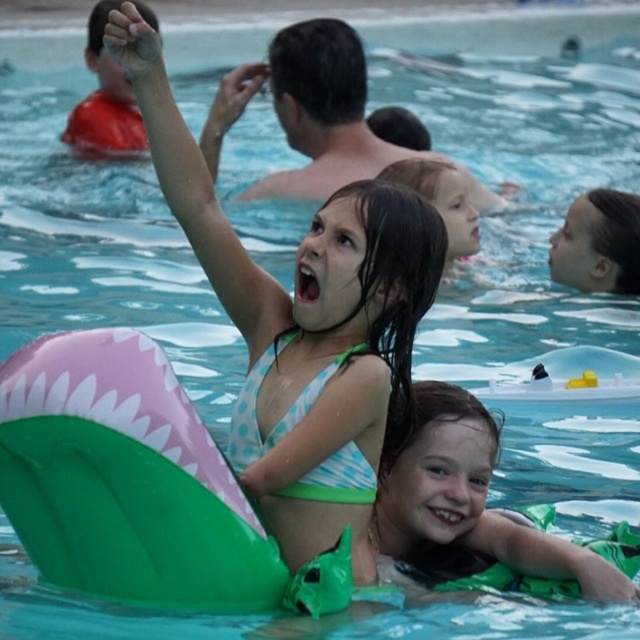
You are a photographer trying to capture a clear shot of the light brown hair at upper center without any obstructions. The green rubber ring at lower right is in the way. Can you adjust your position to avoid it?

The green rubber ring at lower right is positioned under light brown hair at upper center, so moving the camera upwards slightly would allow you to capture the light brown hair at upper center without the green rubber ring at lower right obstructing the view.